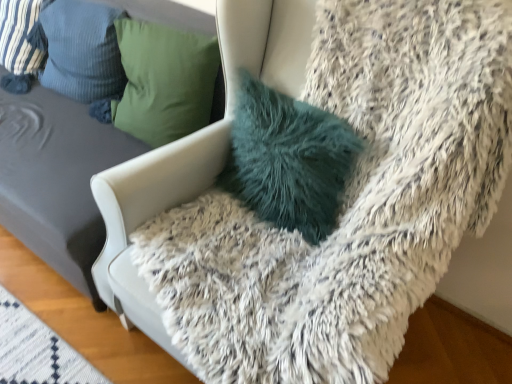
The image size is (512, 384). Describe the element at coordinates (288, 159) in the screenshot. I see `teal fuzzy pillow at center, which ranks as the 1th pillow in right-to-left order` at that location.

Locate an element on the screen. This screenshot has width=512, height=384. striped fabric pillow at upper left, which ranks as the first pillow in left-to-right order is located at coordinates (21, 43).

Where is `teal fuzzy pillow at center, which ranks as the 1th pillow in right-to-left order`? Image resolution: width=512 pixels, height=384 pixels. teal fuzzy pillow at center, which ranks as the 1th pillow in right-to-left order is located at coordinates (288, 159).

From a real-world perspective, is striped fabric pillow at upper left, which is counted as the third pillow, starting from the right, positioned above or below teal fuzzy pillow at center, the 3th pillow viewed from the left?

striped fabric pillow at upper left, which is counted as the third pillow, starting from the right, is situated higher than teal fuzzy pillow at center, the 3th pillow viewed from the left, in the real world.

Between striped fabric pillow at upper left, which ranks as the first pillow in left-to-right order, and teal fuzzy pillow at center, the 3th pillow viewed from the left, which one has more height?

Standing taller between the two is striped fabric pillow at upper left, which ranks as the first pillow in left-to-right order.

Is striped fabric pillow at upper left, which is counted as the third pillow, starting from the right, surrounding teal fuzzy pillow at center, which ranks as the 1th pillow in right-to-left order?

Actually, teal fuzzy pillow at center, which ranks as the 1th pillow in right-to-left order, is outside striped fabric pillow at upper left, which is counted as the third pillow, starting from the right.

Does striped fabric pillow at upper left, which ranks as the first pillow in left-to-right order, turn towards teal fuzzy pillow at center, the 3th pillow viewed from the left?

No, striped fabric pillow at upper left, which ranks as the first pillow in left-to-right order, does not turn towards teal fuzzy pillow at center, the 3th pillow viewed from the left.

From a real-world perspective, is fuzzy white chair at upper right beneath striped fabric pillow at upper left, which is counted as the third pillow, starting from the right?

Correct, in the physical world, fuzzy white chair at upper right is lower than striped fabric pillow at upper left, which is counted as the third pillow, starting from the right.

In the image, is fuzzy white chair at upper right positioned in front of or behind striped fabric pillow at upper left, which ranks as the first pillow in left-to-right order?

fuzzy white chair at upper right is positioned closer to the viewer than striped fabric pillow at upper left, which ranks as the first pillow in left-to-right order.

Would you consider fuzzy white chair at upper right to be distant from striped fabric pillow at upper left, which is counted as the third pillow, starting from the right?

fuzzy white chair at upper right is near striped fabric pillow at upper left, which is counted as the third pillow, starting from the right, not far away.

Does fuzzy white chair at upper right come behind striped fabric pillow at upper left, which is the second pillow in right-to-left order?

That is False.

Between point (5, 191) and point (117, 66), which one is positioned in front?

Positioned in front is point (5, 191).

How different are the orientations of fuzzy white chair at upper right and striped fabric pillow at upper left, which is the second pillow in right-to-left order, in degrees?

0.306 degrees.

Is striped fabric pillow at upper left, which is counted as the third pillow, starting from the right, far away from fuzzy white chair at upper right?

No.

Where is `furniture below the striped fabric pillow at upper left, which is counted as the third pillow, starting from the right (from the image's perspective)`? The image size is (512, 384). furniture below the striped fabric pillow at upper left, which is counted as the third pillow, starting from the right (from the image's perspective) is located at coordinates (57, 179).

Between striped fabric pillow at upper left, which is counted as the third pillow, starting from the right, and fuzzy white chair at upper right, which one has less height?

striped fabric pillow at upper left, which is counted as the third pillow, starting from the right.

Which is more to the left, striped fabric pillow at upper left, which ranks as the first pillow in left-to-right order, or fuzzy white chair at upper right?

striped fabric pillow at upper left, which ranks as the first pillow in left-to-right order, is more to the left.

Is striped fabric pillow at upper left, which ranks as the first pillow in left-to-right order, to the left or to the right of striped fabric pillow at upper left, which is the second pillow in right-to-left order, in the image?

In the image, striped fabric pillow at upper left, which ranks as the first pillow in left-to-right order, appears on the left side of striped fabric pillow at upper left, which is the second pillow in right-to-left order.

Is striped fabric pillow at upper left, arranged as the second pillow when viewed from the left, located within striped fabric pillow at upper left, which ranks as the first pillow in left-to-right order?

No, striped fabric pillow at upper left, arranged as the second pillow when viewed from the left, is not a part of striped fabric pillow at upper left, which ranks as the first pillow in left-to-right order.

Considering their positions, is teal fuzzy pillow at center, the 3th pillow viewed from the left, located in front of or behind striped fabric pillow at upper left, which is counted as the third pillow, starting from the right?

teal fuzzy pillow at center, the 3th pillow viewed from the left, is in front of striped fabric pillow at upper left, which is counted as the third pillow, starting from the right.

From a real-world perspective, is teal fuzzy pillow at center, which ranks as the 1th pillow in right-to-left order, physically above striped fabric pillow at upper left, which is counted as the third pillow, starting from the right?

Incorrect, from a real-world perspective, teal fuzzy pillow at center, which ranks as the 1th pillow in right-to-left order, is lower than striped fabric pillow at upper left, which is counted as the third pillow, starting from the right.

Which of these two, teal fuzzy pillow at center, the 3th pillow viewed from the left, or striped fabric pillow at upper left, which ranks as the first pillow in left-to-right order, is thinner?

teal fuzzy pillow at center, the 3th pillow viewed from the left, is thinner.

Does striped fabric pillow at upper left, arranged as the second pillow when viewed from the left, have a greater width compared to teal fuzzy pillow at center, the 3th pillow viewed from the left?

Yes, striped fabric pillow at upper left, arranged as the second pillow when viewed from the left, is wider than teal fuzzy pillow at center, the 3th pillow viewed from the left.

Between point (57, 60) and point (273, 188), which one is positioned in front?

The point (273, 188) is more forward.

Can we say striped fabric pillow at upper left, arranged as the second pillow when viewed from the left, lies outside teal fuzzy pillow at center, which ranks as the 1th pillow in right-to-left order?

Indeed, striped fabric pillow at upper left, arranged as the second pillow when viewed from the left, is completely outside teal fuzzy pillow at center, which ranks as the 1th pillow in right-to-left order.

What are the coordinates of `the 2nd pillow above the teal fuzzy pillow at center, which ranks as the 1th pillow in right-to-left order (from the image's perspective)` in the screenshot? It's located at (21, 43).

The image size is (512, 384). I want to click on pillow on the left of the fuzzy white chair at upper right, so click(21, 43).

When comparing their distances from teal fuzzy pillow at center, which ranks as the 1th pillow in right-to-left order, does striped fabric pillow at upper left, which ranks as the first pillow in left-to-right order, or striped fabric pillow at upper left, arranged as the second pillow when viewed from the left, seem further?

striped fabric pillow at upper left, which ranks as the first pillow in left-to-right order.

Estimate the real-world distances between objects in this image. Which object is closer to striped fabric pillow at upper left, which is counted as the third pillow, starting from the right, fuzzy white chair at upper right or teal fuzzy pillow at center, the 3th pillow viewed from the left?

The object closer to striped fabric pillow at upper left, which is counted as the third pillow, starting from the right, is fuzzy white chair at upper right.

Estimate the real-world distances between objects in this image. Which object is closer to striped fabric pillow at upper left, which is counted as the third pillow, starting from the right, striped fabric pillow at upper left, arranged as the second pillow when viewed from the left, or fuzzy white chair at upper right?

striped fabric pillow at upper left, arranged as the second pillow when viewed from the left, is positioned closer to the anchor striped fabric pillow at upper left, which is counted as the third pillow, starting from the right.

Estimate the real-world distances between objects in this image. Which object is closer to fuzzy white chair at upper right, teal fuzzy pillow at center, which ranks as the 1th pillow in right-to-left order, or striped fabric pillow at upper left, arranged as the second pillow when viewed from the left?

striped fabric pillow at upper left, arranged as the second pillow when viewed from the left.

When comparing their distances from teal fuzzy pillow at center, which ranks as the 1th pillow in right-to-left order, does striped fabric pillow at upper left, which is counted as the third pillow, starting from the right, or fuzzy white chair at upper right seem closer?

Among the two, fuzzy white chair at upper right is located nearer to teal fuzzy pillow at center, which ranks as the 1th pillow in right-to-left order.

Which object lies nearer to the anchor point striped fabric pillow at upper left, which ranks as the first pillow in left-to-right order, striped fabric pillow at upper left, arranged as the second pillow when viewed from the left, or teal fuzzy pillow at center, which ranks as the 1th pillow in right-to-left order?

striped fabric pillow at upper left, arranged as the second pillow when viewed from the left, is closer to striped fabric pillow at upper left, which ranks as the first pillow in left-to-right order.

Consider the image. Which object lies further to the anchor point teal fuzzy pillow at center, which ranks as the 1th pillow in right-to-left order, striped fabric pillow at upper left, which is the second pillow in right-to-left order, or fuzzy white chair at upper right?

striped fabric pillow at upper left, which is the second pillow in right-to-left order.

Estimate the real-world distances between objects in this image. Which object is further from striped fabric pillow at upper left, which is the second pillow in right-to-left order, striped fabric pillow at upper left, which ranks as the first pillow in left-to-right order, or teal fuzzy pillow at center, which ranks as the 1th pillow in right-to-left order?

The object further to striped fabric pillow at upper left, which is the second pillow in right-to-left order, is teal fuzzy pillow at center, which ranks as the 1th pillow in right-to-left order.

Where is `pillow between fuzzy white chair at upper right and teal fuzzy pillow at center, which ranks as the 1th pillow in right-to-left order`? pillow between fuzzy white chair at upper right and teal fuzzy pillow at center, which ranks as the 1th pillow in right-to-left order is located at coordinates (82, 50).

Find the location of a particular element. pillow situated between striped fabric pillow at upper left, which ranks as the first pillow in left-to-right order, and teal fuzzy pillow at center, the 3th pillow viewed from the left, from left to right is located at coordinates (x=82, y=50).

Where is `furniture between striped fabric pillow at upper left, which ranks as the first pillow in left-to-right order, and teal fuzzy pillow at center, the 3th pillow viewed from the left, from left to right`? The image size is (512, 384). furniture between striped fabric pillow at upper left, which ranks as the first pillow in left-to-right order, and teal fuzzy pillow at center, the 3th pillow viewed from the left, from left to right is located at coordinates (57, 179).